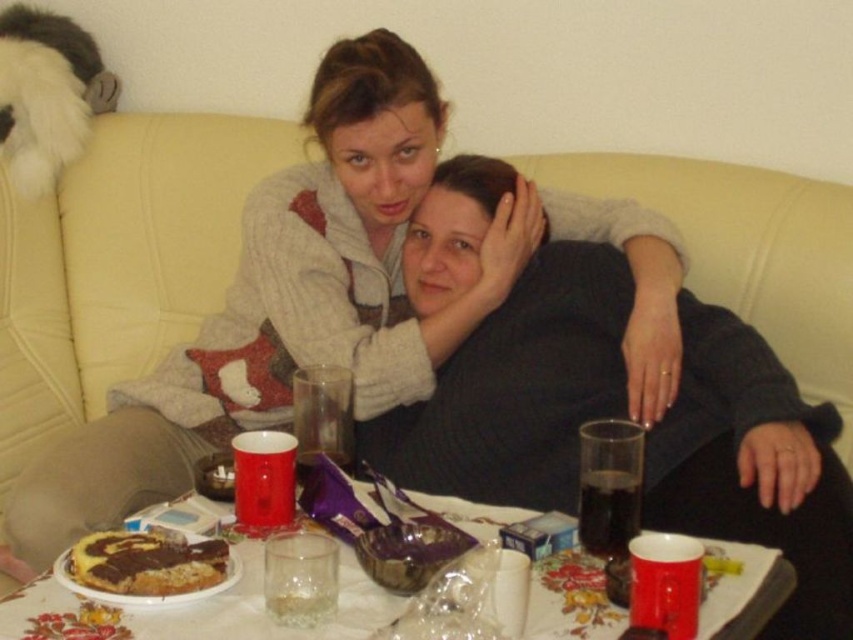
You are a guest at a cozy living room and see the point marked at coordinates (264, 609). What object is located at that point?

The point at coordinates (264, 609) marks the translucent glass mug at lower center.

You are a guest at a dinner party and see the matte glass cup at center and the translucent glass mug at lower center on the table. Which one has a larger capacity?

The matte glass cup at center has a larger capacity than the translucent glass mug at lower center because it is bigger.